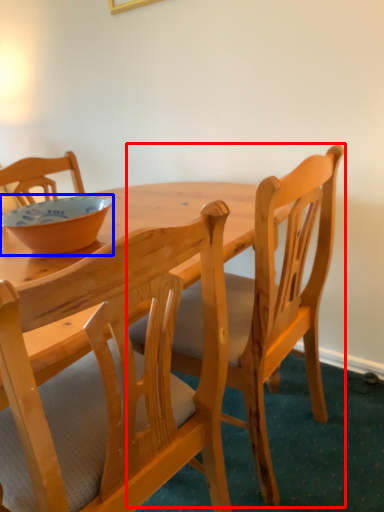
Question: Which of the following is the farthest to the observer, chair (highlighted by a red box) or bowl (highlighted by a blue box)?

Choices:
 (A) chair
 (B) bowl

Answer: (B)